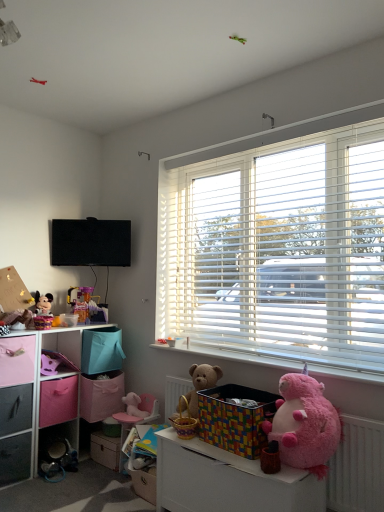
Question: From the image's perspective, is pink plush toy at lower left, arranged as the 3th toy when viewed from the top, above or below pink fabric basket at lower left, which is counted as the second toy, starting from the left?

Choices:
 (A) below
 (B) above

Answer: (A)

Question: Considering the positions of pink plush toy at lower left, the 3th toy from the left, and pink fabric basket at lower left, arranged as the 2th toy when ordered from the bottom, in the image, is pink plush toy at lower left, the 3th toy from the left, bigger or smaller than pink fabric basket at lower left, arranged as the 2th toy when ordered from the bottom,?

Choices:
 (A) big
 (B) small

Answer: (A)

Question: Considering the real-world distances, which object is farthest from the white plastic window sill at lower center?

Choices:
 (A) metallic gray drawer at lower left, the second drawer positioned from the left
 (B) soft brown teddy bear at center, arranged as the 1th teddy bear when viewed from the back
 (C) pink cardboard box at lower left, which is counted as the 2th cardboard box, starting from the right
 (D) pink fabric storage box at left, the 1th storage box viewed from the back
 (E) white plastic radiator at lower right

Answer: (A)

Question: Estimate the real-world distances between objects in this image. Which object is farther from the fuzzy pink teddy bear at lower right, which is the first teddy bear in right-to-left order?

Choices:
 (A) brushed metal drawer at lower left, which is the 3th drawer in right-to-left order
 (B) matte gray drawer at lower left, which is the 3th drawer in left-to-right order
 (C) pink fabric storage box at left, which is counted as the second storage box, starting from the right
 (D) black matte television at upper left
 (E) white plastic radiator at lower right

Answer: (D)